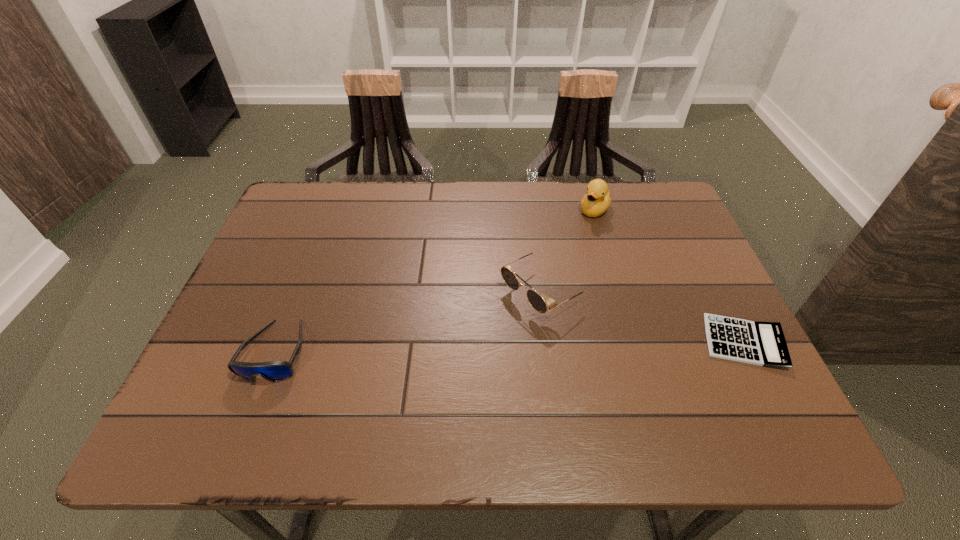
Locate an element on the screen. This screenshot has width=960, height=540. free space on the desktop that is between the shorter sunglasses and the calculator and is positioned facing forward on the second object from right to left is located at coordinates (498, 347).

The height and width of the screenshot is (540, 960). Find the location of `vacant spot on the desktop that is between the shorter sunglasses and the rightmost object and is positioned on the front lenses of the right sunglasses`. vacant spot on the desktop that is between the shorter sunglasses and the rightmost object and is positioned on the front lenses of the right sunglasses is located at coordinates (455, 348).